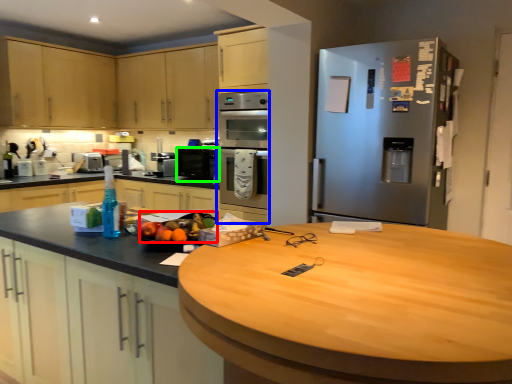
Question: Which is nearer to the fruit (highlighted by a red box)? oven (highlighted by a blue box) or kitchen appliance (highlighted by a green box).

Choices:
 (A) oven
 (B) kitchen appliance

Answer: (A)